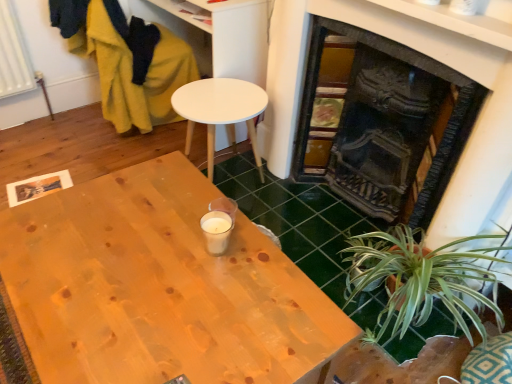
Question: Considering the relative sizes of velvet mustard yellow swivel chair at left and white matte table at center in the image provided, is velvet mustard yellow swivel chair at left smaller than white matte table at center?

Choices:
 (A) no
 (B) yes

Answer: (A)

Question: Is velvet mustard yellow swivel chair at left oriented towards white matte table at center?

Choices:
 (A) yes
 (B) no

Answer: (B)

Question: Is velvet mustard yellow swivel chair at left facing away from white matte table at center?

Choices:
 (A) no
 (B) yes

Answer: (A)

Question: Can you confirm if velvet mustard yellow swivel chair at left is thinner than white matte table at center?

Choices:
 (A) no
 (B) yes

Answer: (A)

Question: Does velvet mustard yellow swivel chair at left appear on the left side of white matte table at center?

Choices:
 (A) no
 (B) yes

Answer: (B)

Question: Is velvet mustard yellow swivel chair at left wider or thinner than black cast iron fireplace at right?

Choices:
 (A) wide
 (B) thin

Answer: (A)

Question: Considering their positions, is velvet mustard yellow swivel chair at left located in front of or behind black cast iron fireplace at right?

Choices:
 (A) front
 (B) behind

Answer: (B)

Question: From the image's perspective, is velvet mustard yellow swivel chair at left above or below black cast iron fireplace at right?

Choices:
 (A) below
 (B) above

Answer: (B)

Question: From a real-world perspective, relative to black cast iron fireplace at right, is velvet mustard yellow swivel chair at left vertically above or below?

Choices:
 (A) above
 (B) below

Answer: (B)

Question: Is natural wood desk at center in front of or behind white matte table at center in the image?

Choices:
 (A) behind
 (B) front

Answer: (B)

Question: From the image's perspective, is natural wood desk at center above or below white matte table at center?

Choices:
 (A) above
 (B) below

Answer: (B)

Question: In terms of size, does natural wood desk at center appear bigger or smaller than white matte table at center?

Choices:
 (A) big
 (B) small

Answer: (A)

Question: Which is correct: natural wood desk at center is inside white matte table at center, or outside of it?

Choices:
 (A) inside
 (B) outside

Answer: (B)

Question: In terms of width, does green leafy plant at lower right look wider or thinner when compared to white matte table at center?

Choices:
 (A) wide
 (B) thin

Answer: (A)

Question: From a real-world perspective, relative to white matte table at center, is green leafy plant at lower right vertically above or below?

Choices:
 (A) below
 (B) above

Answer: (A)